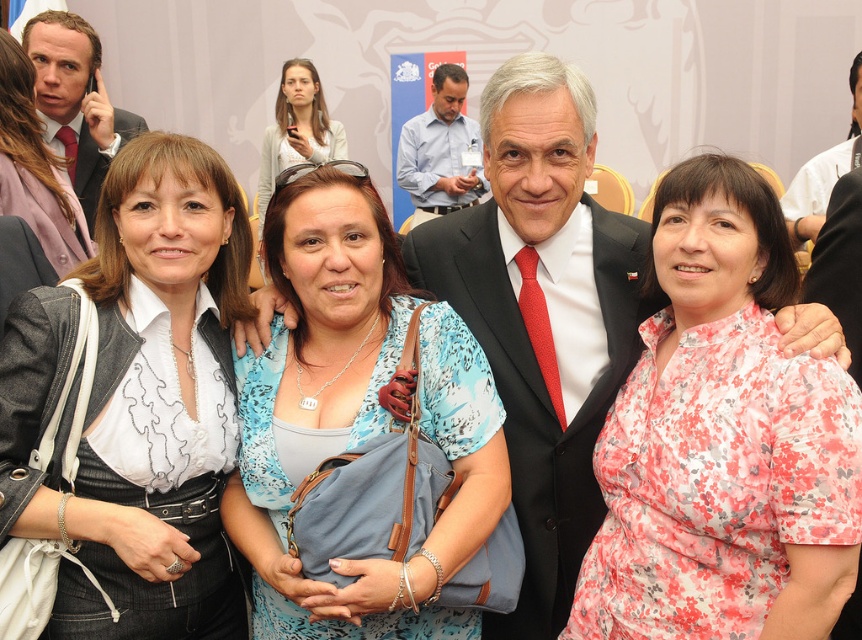
You are a photographer at a formal event. You need to adjust the lighting so that the matte white blouse at center and the blue floral blouse at center are both evenly illuminated. Given their distance apart, will you need to adjust the lighting for each individually or can you set it once for both?

The matte white blouse at center is 10.94 inches from the blue floral blouse at center. Since the distance between them is relatively small, you can set the lighting once for both to ensure even illumination.

You are standing in front of the group photo and want to focus on the two points in the image. Which of the two points, point 1 at coordinates [305,609] or point 2 at coordinates [322,100], is closer to you?

Point 1 at coordinates [305,609] is closer to you than point 2 at coordinates [322,100].